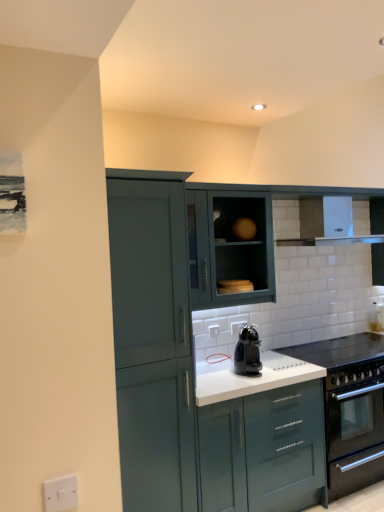
Locate an element on the screen. empty space that is ontop of matte teal cabinet at center, which is the 3th cabinetry in back-to-front order (from a real-world perspective) is located at coordinates (233, 366).